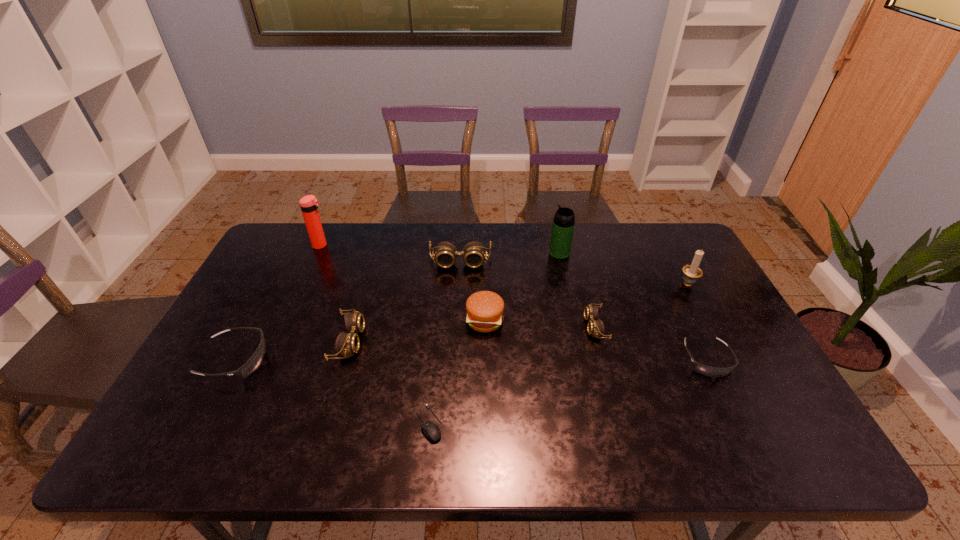
Locate an element on the screen. free space located 0.150m on the lenses of the smaller black goggles is located at coordinates (744, 435).

This screenshot has height=540, width=960. Find the location of `free location located on the left of the nearest object`. free location located on the left of the nearest object is located at coordinates (254, 423).

Where is `goggles present at the far edge`? This screenshot has width=960, height=540. goggles present at the far edge is located at coordinates (473, 253).

At what (x,y) coordinates should I click in order to perform the action: click on object present at the near edge. Please return your answer as a coordinate pair (x, y). Image resolution: width=960 pixels, height=540 pixels. Looking at the image, I should click on (431, 430).

This screenshot has height=540, width=960. Find the location of `thermos bottle at the left edge`. thermos bottle at the left edge is located at coordinates pos(308,204).

At what (x,y) coordinates should I click in order to perform the action: click on goggles at the left edge. Please return your answer as a coordinate pair (x, y). This screenshot has height=540, width=960. Looking at the image, I should click on (254, 362).

Identify the location of candle_holder that is positioned at the right edge. Image resolution: width=960 pixels, height=540 pixels. (691, 272).

The height and width of the screenshot is (540, 960). What are the coordinates of `goggles that is at the right edge` in the screenshot? It's located at (709, 371).

The height and width of the screenshot is (540, 960). What are the coordinates of `object present at the far left corner` in the screenshot? It's located at (308, 204).

I want to click on vacant space at the far edge, so click(464, 237).